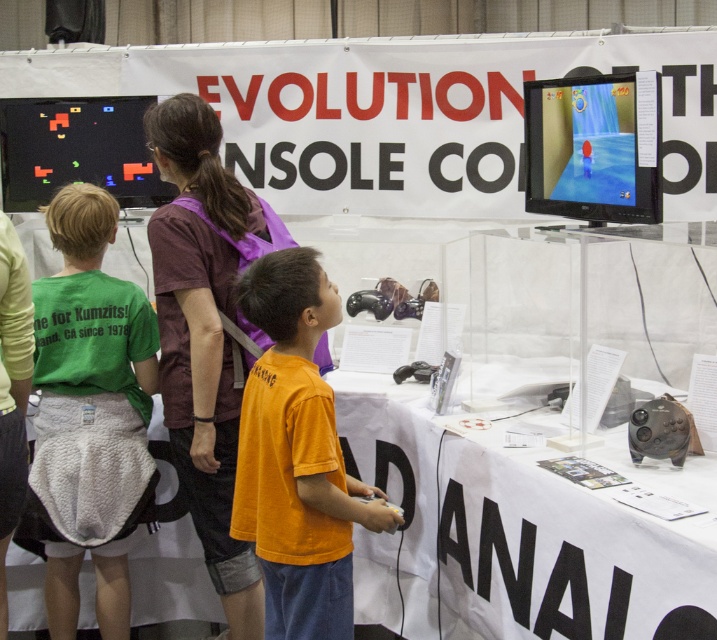
Is white fabric table at center shorter than orange matte shirt at center?

Yes, white fabric table at center is shorter than orange matte shirt at center.

Is white fabric table at center to the right of orange matte shirt at center from the viewer's perspective?

Correct, you'll find white fabric table at center to the right of orange matte shirt at center.

Find the location of a particular element. The image size is (717, 640). white fabric table at center is located at coordinates coord(516,532).

At what (x,y) coordinates should I click in order to perform the action: click on white fabric table at center. Please return your answer as a coordinate pair (x, y). The height and width of the screenshot is (640, 717). Looking at the image, I should click on (516, 532).

Can you confirm if orange matte shirt at center is bigger than shiny plastic tv at upper right?

Yes.

Can you confirm if orange matte shirt at center is positioned above shiny plastic tv at upper right?

No.

Which is behind, point (348, 564) or point (635, 180)?

Point (635, 180)

Identify the location of orange matte shirt at center. (295, 456).

Who is positioned more to the right, white fabric table at center or purple fabric shirt at center?

white fabric table at center is more to the right.

Looking at this image, who is higher up, white fabric table at center or purple fabric shirt at center?

Positioned higher is purple fabric shirt at center.

Find the location of `white fabric table at center`. white fabric table at center is located at coordinates (516, 532).